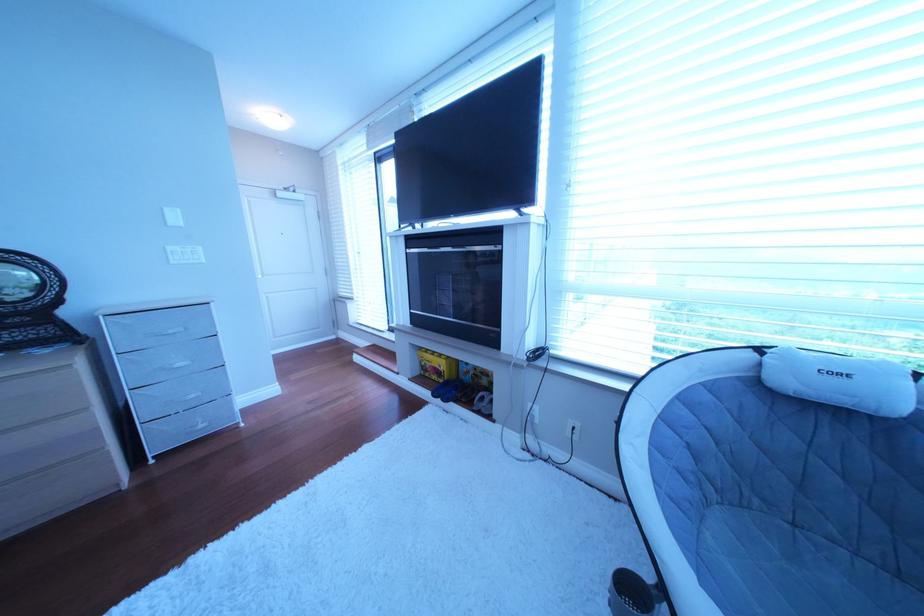
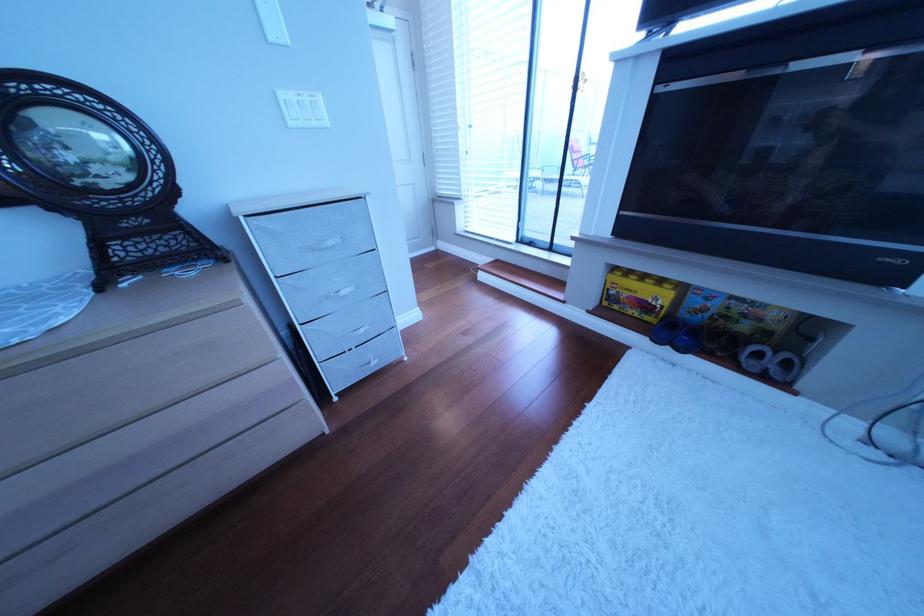
In the second image, find the point that corresponds to point (187, 403) in the first image.

(358, 339)